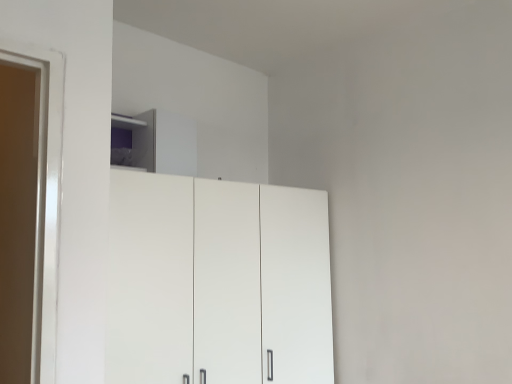
Question: Is point (160, 114) positioned closer to the camera than point (217, 291)?

Choices:
 (A) closer
 (B) farther

Answer: (B)

Question: Is white glossy cabinet at upper center situated inside white matte cupboard at center or outside?

Choices:
 (A) outside
 (B) inside

Answer: (A)

Question: Relative to white matte cupboard at center, is white glossy cabinet at upper center in front or behind?

Choices:
 (A) front
 (B) behind

Answer: (B)

Question: In the image, is white matte cupboard at center on the left side or the right side of white glossy cabinet at upper center?

Choices:
 (A) left
 (B) right

Answer: (B)

Question: Considering the positions of point (190, 200) and point (151, 125), is point (190, 200) closer or farther from the camera than point (151, 125)?

Choices:
 (A) closer
 (B) farther

Answer: (A)

Question: Is white matte cupboard at center inside the boundaries of white glossy cabinet at upper center, or outside?

Choices:
 (A) inside
 (B) outside

Answer: (B)

Question: From the image's perspective, is white matte cupboard at center located above or below white glossy cabinet at upper center?

Choices:
 (A) above
 (B) below

Answer: (B)